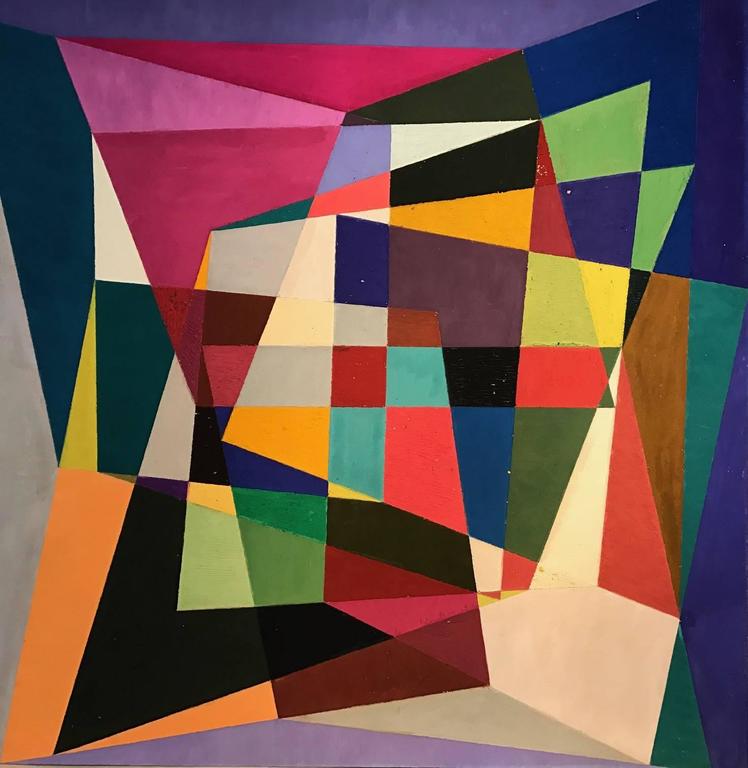
Image resolution: width=748 pixels, height=768 pixels. I want to click on tan section, so click(586, 699).